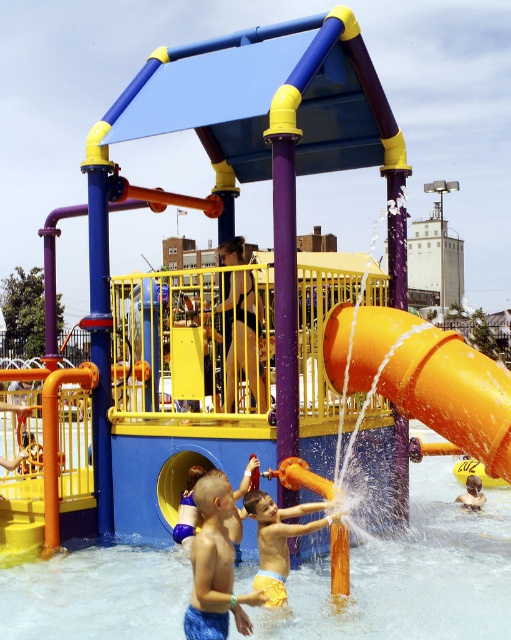
Can you confirm if orange matte slide at center is smaller than yellow matte shorts at lower center?

Yes.

Is orange matte slide at center wider than yellow matte shorts at lower center?

No, orange matte slide at center is not wider than yellow matte shorts at lower center.

Who is more distant from viewer, [331,353] or [265,532]?

The point [331,353] is more distant.

Find the location of `orange matte slide at center`. orange matte slide at center is located at coordinates (424, 378).

Is orange matte water at center bigger than orange matte slide at center?

Indeed, orange matte water at center has a larger size compared to orange matte slide at center.

Between orange matte water at center and orange matte slide at center, which one appears on the right side from the viewer's perspective?

orange matte water at center is more to the right.

Is point (73, 561) positioned after point (368, 310)?

That is True.

This screenshot has height=640, width=511. In order to click on orange matte water at center in this screenshot , I will do `click(411, 573)`.

Looking at this image, is orange matte water at center wider than smooth black shorts at center?

Indeed, orange matte water at center has a greater width compared to smooth black shorts at center.

Is orange matte water at center taller than smooth black shorts at center?

Incorrect, orange matte water at center's height is not larger of smooth black shorts at center's.

Is point (368, 552) positioned before point (226, 301)?

Yes, point (368, 552) is in front of point (226, 301).

At what (x,y) coordinates should I click in order to perform the action: click on orange matte water at center. Please return your answer as a coordinate pair (x, y). The image size is (511, 640). Looking at the image, I should click on 411,573.